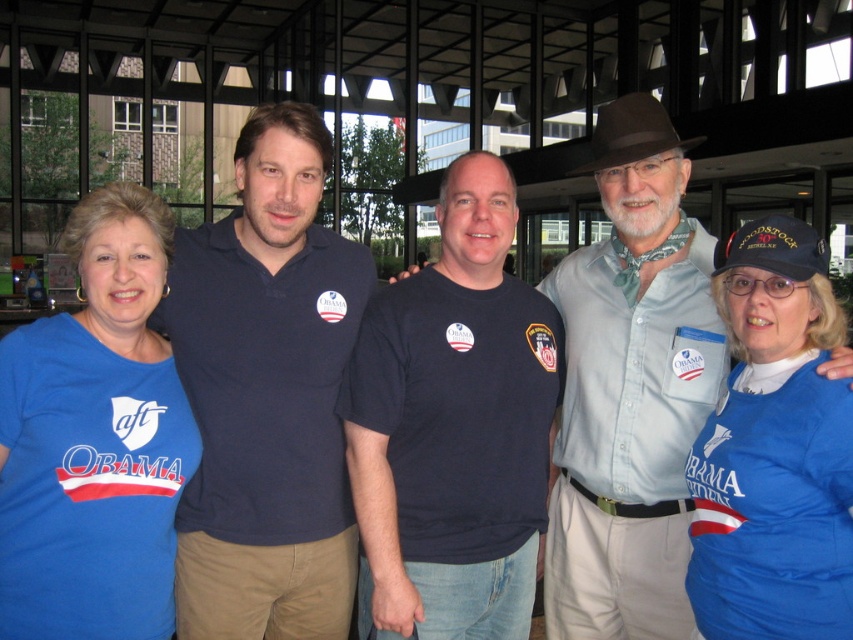
Does dark blue shirt at center have a lesser width compared to blue fabric shirt at center?

No, dark blue shirt at center is not thinner than blue fabric shirt at center.

Based on the photo, is dark blue shirt at center to the left of blue fabric shirt at center from the viewer's perspective?

Yes, dark blue shirt at center is to the left of blue fabric shirt at center.

Is point (679, 346) closer to camera compared to point (761, 467)?

That is False.

Find the location of a particular element. This screenshot has height=640, width=853. dark blue shirt at center is located at coordinates (630, 408).

Based on the photo, which is below, dark blue polo shirt at center or brown felt hat at center?

Positioned lower is dark blue polo shirt at center.

Describe the element at coordinates (265, 394) in the screenshot. I see `dark blue polo shirt at center` at that location.

This screenshot has height=640, width=853. Find the location of `dark blue polo shirt at center`. dark blue polo shirt at center is located at coordinates (265, 394).

Which of these two, dark blue t-shirt at center or blue fabric shirt at left, stands taller?

dark blue t-shirt at center

Is dark blue t-shirt at center thinner than blue fabric shirt at left?

No.

Between point (462, 529) and point (144, 243), which one is positioned behind?

The point (462, 529) is more distant.

This screenshot has width=853, height=640. Identify the location of dark blue t-shirt at center. (454, 428).